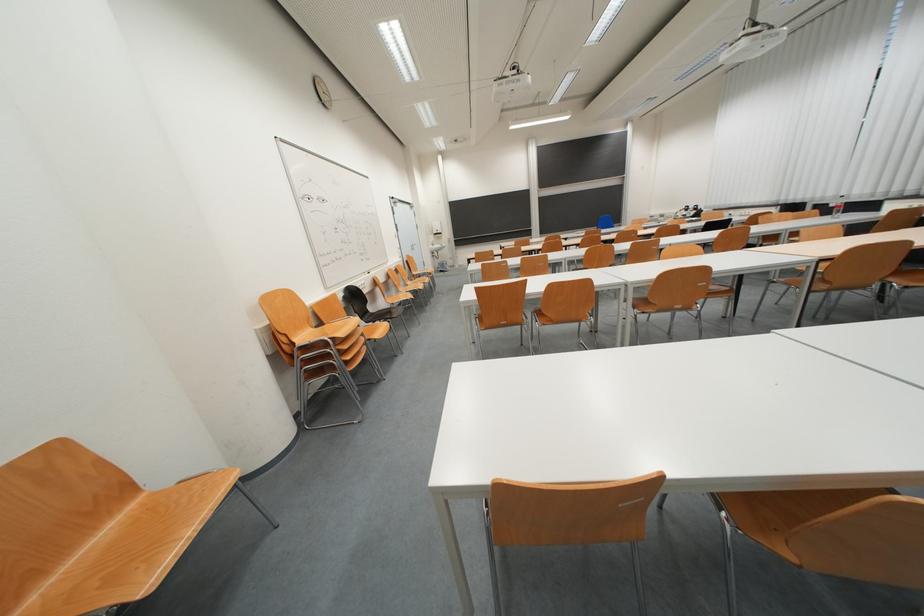
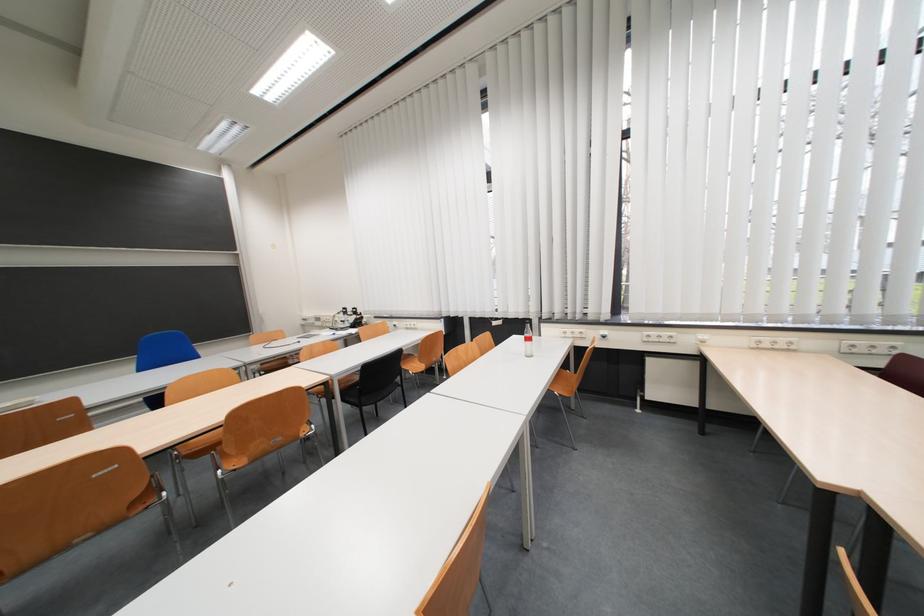
Where in the second image is the point corresponding to point 699,213 from the first image?

(357, 315)